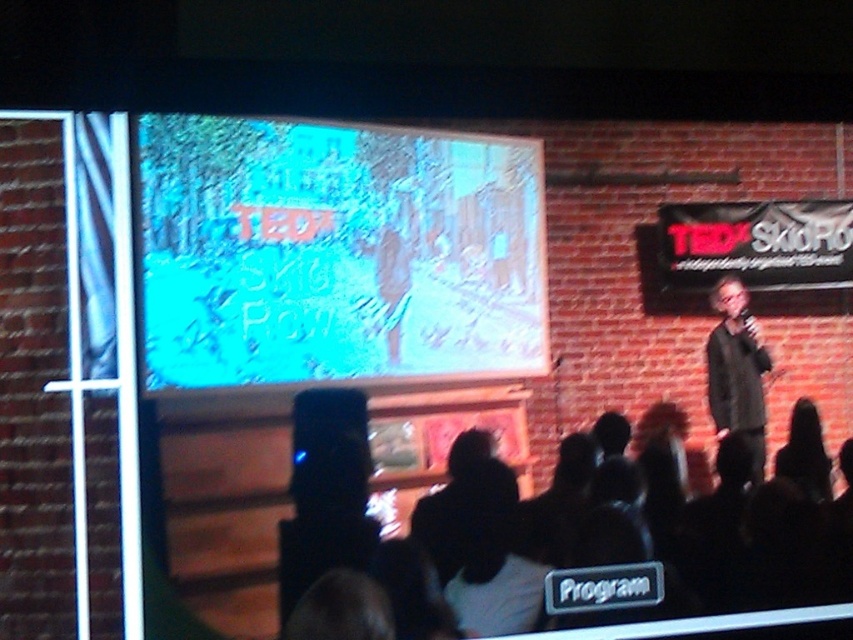
Question: Does blue glossy screen at upper center appear under dark gray sweater at right?

Choices:
 (A) no
 (B) yes

Answer: (A)

Question: Is blue glossy screen at upper center to the left of dark gray sweater at right from the viewer's perspective?

Choices:
 (A) yes
 (B) no

Answer: (A)

Question: Which point appears farthest from the camera in this image?

Choices:
 (A) (486, 208)
 (B) (357, 605)

Answer: (A)

Question: Does blue glossy screen at upper center appear on the right side of dark gray sweater at right?

Choices:
 (A) yes
 (B) no

Answer: (B)

Question: Which object is farther from the camera taking this photo?

Choices:
 (A) black fabric at lower center
 (B) blue glossy screen at upper center
 (C) dark gray sweater at right

Answer: (C)

Question: Which object is the closest to the blue glossy screen at upper center?

Choices:
 (A) dark gray sweater at right
 (B) black fabric at lower center

Answer: (B)